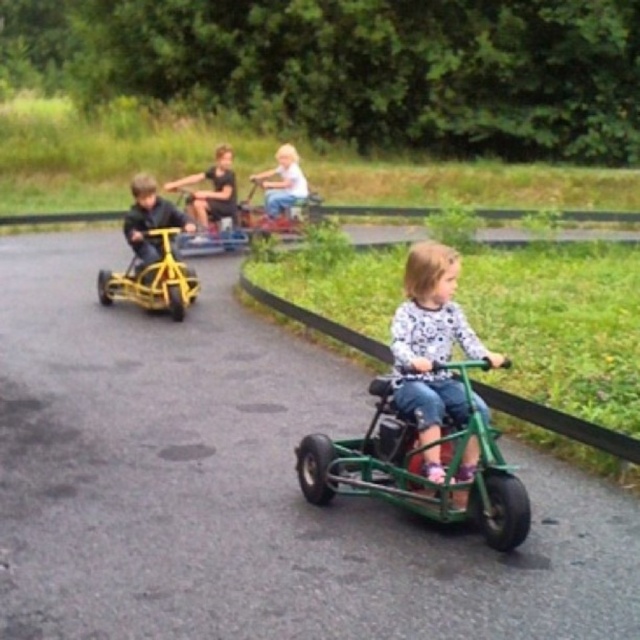
Question: Is green matte tricycle at center bigger than white matte shirt at center?

Choices:
 (A) yes
 (B) no

Answer: (B)

Question: Is patterned fabric shirt at center smaller than yellow matte toy car at left?

Choices:
 (A) yes
 (B) no

Answer: (A)

Question: Among these objects, which one is nearest to the camera?

Choices:
 (A) white matte shirt at center
 (B) yellow plastic go-kart at left

Answer: (B)

Question: Can you confirm if green matte tricycle at center is positioned below matte yellow go-kart at left?

Choices:
 (A) no
 (B) yes

Answer: (B)

Question: Estimate the real-world distances between objects in this image. Which object is farther from the matte yellow go-kart at left?

Choices:
 (A) yellow matte toy car at left
 (B) yellow plastic go-kart at left
 (C) green matte tricycle at center

Answer: (C)

Question: Which object is closer to the camera taking this photo?

Choices:
 (A) white matte shirt at center
 (B) green matte tricycle at center
 (C) matte yellow go-kart at left

Answer: (B)